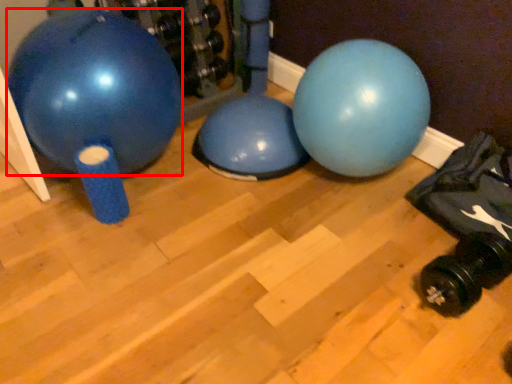
Question: From the image's perspective, what is the correct spatial relationship of ball (annotated by the red box) in relation to dumbbell?

Choices:
 (A) below
 (B) above

Answer: (B)